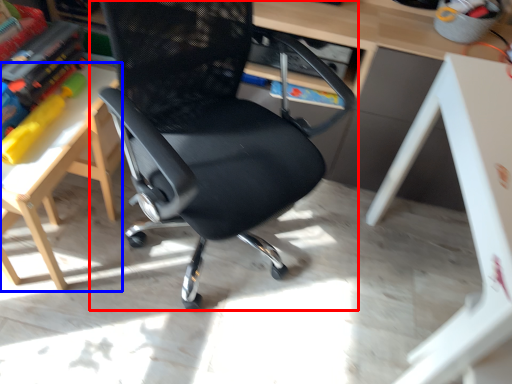
Question: Which object is closer to the camera taking this photo, chair (highlighted by a red box) or table (highlighted by a blue box)?

Choices:
 (A) chair
 (B) table

Answer: (A)